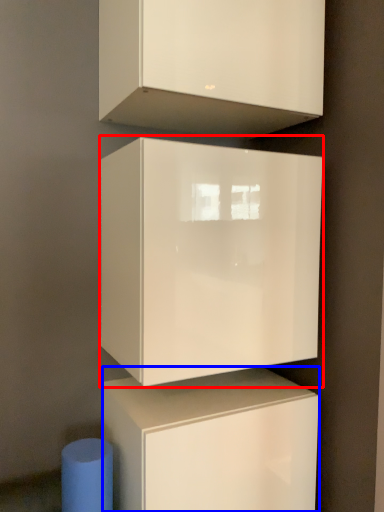
Question: Which object appears farthest to the camera in this image, cabinetry (highlighted by a red box) or cabinetry (highlighted by a blue box)?

Choices:
 (A) cabinetry
 (B) cabinetry

Answer: (B)